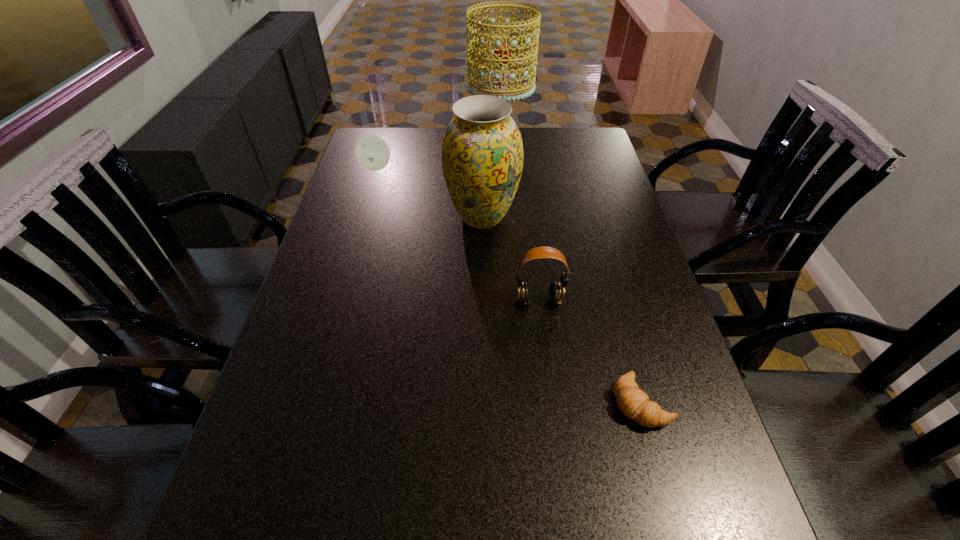
At what (x,y) coordinates should I click in order to perform the action: click on vacant region at the left edge of the desktop. Please return your answer as a coordinate pair (x, y). The image size is (960, 540). Looking at the image, I should click on (314, 415).

In the image, there is a desktop. In order to click on free space at the right edge in this screenshot , I will do pos(581,235).

You are a GUI agent. You are given a task and a screenshot of the screen. Output one action in this format:
    pyautogui.click(x=<x>, y=<y>)
    Task: Click on the unoccupied position between the tallest object and the rightmost object
    The width and height of the screenshot is (960, 540).
    Given the screenshot: What is the action you would take?
    [570, 274]

Identify the location of vacant region between the rightmost object and the second shortest object. The height and width of the screenshot is (540, 960). (509, 285).

This screenshot has height=540, width=960. In order to click on free spot between the lampshade and the leftmost object in this screenshot , I will do `click(438, 157)`.

Locate an element on the screen. The image size is (960, 540). empty location between the leftmost object and the tallest object is located at coordinates (438, 157).

Image resolution: width=960 pixels, height=540 pixels. In order to click on vacant point located between the leftmost object and the fourth shortest object in this screenshot , I will do `click(429, 192)`.

Locate an element on the screen. The image size is (960, 540). vacant area that lies between the fourth farthest object and the shortest object is located at coordinates (590, 352).

Find the location of a particular element. This screenshot has width=960, height=540. free space between the vase and the rightmost object is located at coordinates (562, 309).

Locate an element on the screen. Image resolution: width=960 pixels, height=540 pixels. unoccupied area between the headset and the nearest object is located at coordinates (590, 352).